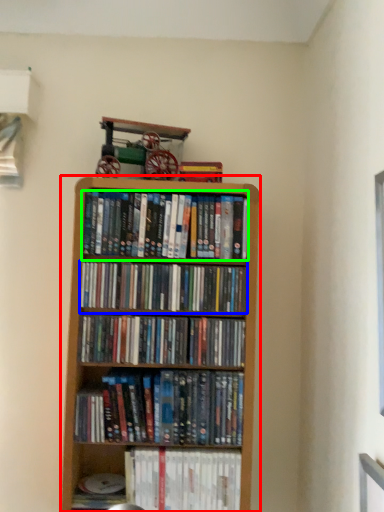
Question: Which is nearer to the bookcase (highlighted by a red box)? book (highlighted by a blue box) or book (highlighted by a green box).

Choices:
 (A) book
 (B) book

Answer: (A)